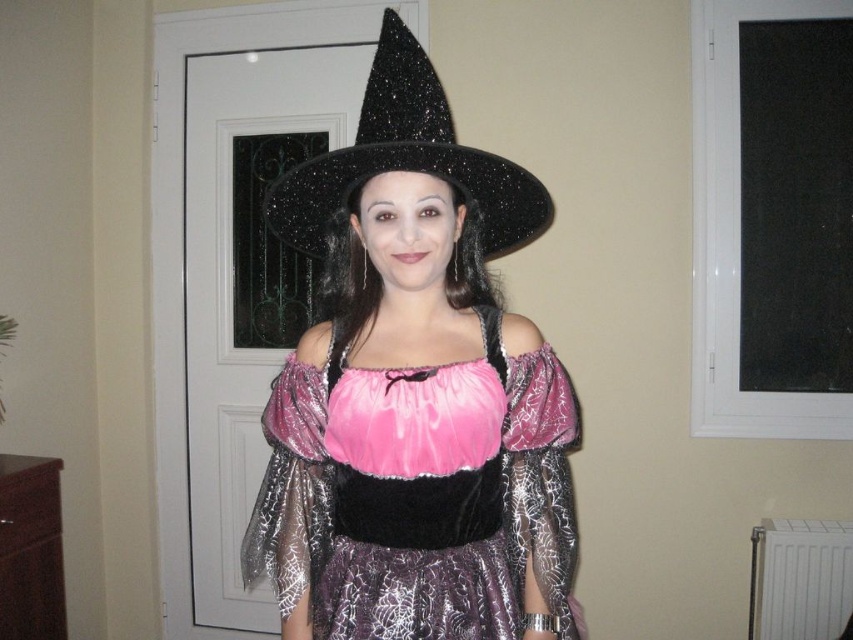
Question: Which point appears farthest from the camera in this image?

Choices:
 (A) (379, 116)
 (B) (308, 381)

Answer: (B)

Question: From the image, what is the correct spatial relationship of pink satin dress at center in relation to black glittery witch hat at center?

Choices:
 (A) above
 (B) below

Answer: (B)

Question: Does pink satin dress at center have a lesser width compared to black glittery witch hat at center?

Choices:
 (A) yes
 (B) no

Answer: (B)

Question: Can you confirm if pink satin dress at center is positioned to the left of black glittery witch hat at center?

Choices:
 (A) yes
 (B) no

Answer: (B)